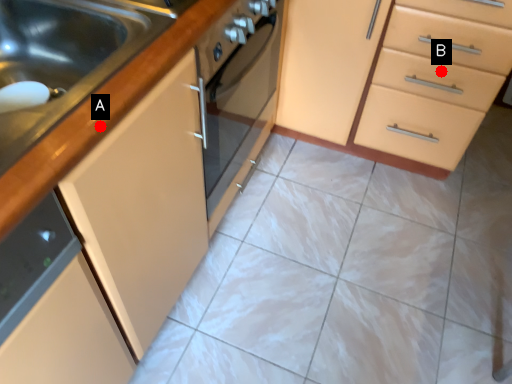
Question: Two points are circled on the image, labeled by A and B beside each circle. Among these points, which one is farthest from the camera?

Choices:
 (A) A is further
 (B) B is further

Answer: (B)